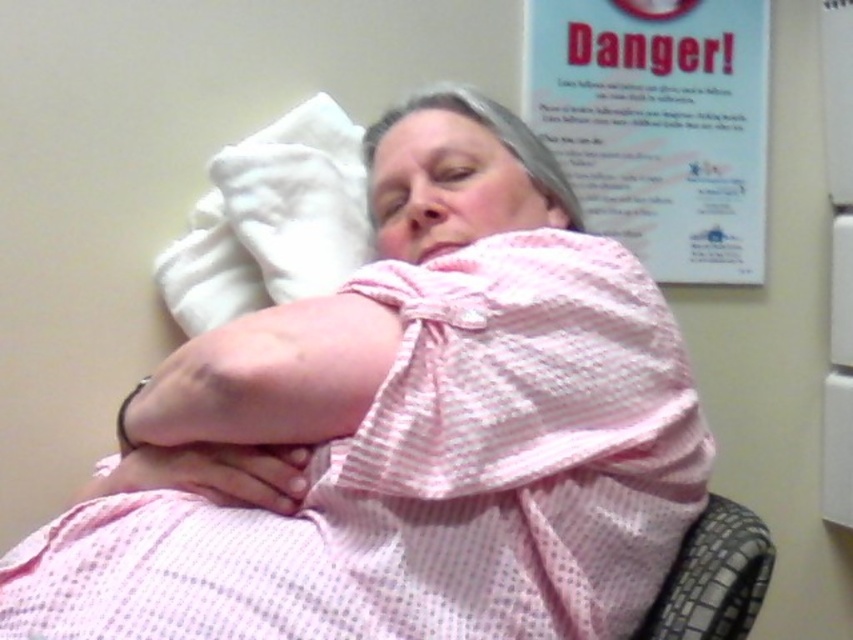
You are a nurse in a hospital room. You need to place a new chart on the white paper at upper right without blocking the white soft pillow at upper left. Is this possible?

The white soft pillow at upper left is behind the white paper at upper right, so placing the chart on the white paper at upper right will not block the pillow since it is already behind the paper.

You are a nurse in a hospital. You need to place two medical supplies at the coordinates point (349, 186) and point (717, 625). According to the image, which point is closer to the patient lying down?

Point (717, 625) is closer to the patient lying down because point (349, 186) is behind point (717, 625), meaning it is farther away from the patient.

You are a nurse standing 5 feet away from the bed. You need to reach the white soft pillow at upper left to adjust it for the patient. Is the pillow within your reach?

The white soft pillow at upper left is 3.98 feet away from the viewer. Since you are standing 5 feet away from the bed, the pillow is slightly out of your reach.